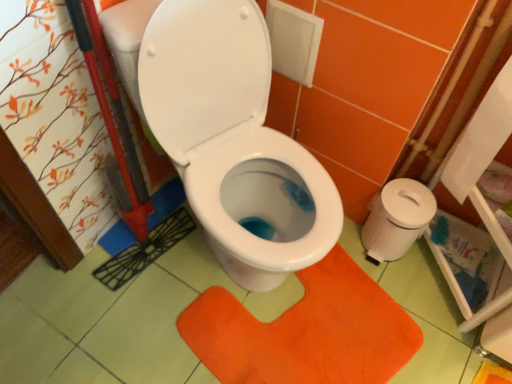
Question: From a real-world perspective, is white plastic toilet paper at right, which is the 2th toilet paper from front to back, on orange textured mat at center?

Choices:
 (A) no
 (B) yes

Answer: (B)

Question: Can you confirm if white plastic toilet paper at right, which is the 2th toilet paper from front to back, is wider than orange textured mat at center?

Choices:
 (A) yes
 (B) no

Answer: (B)

Question: Is white plastic toilet paper at right, which is the 2th toilet paper from front to back, facing away from orange textured mat at center?

Choices:
 (A) no
 (B) yes

Answer: (A)

Question: Considering the relative positions of white plastic toilet paper at right, which is the 2th toilet paper from front to back, and orange textured mat at center in the image provided, is white plastic toilet paper at right, which is the 2th toilet paper from front to back, to the right of orange textured mat at center from the viewer's perspective?

Choices:
 (A) yes
 (B) no

Answer: (A)

Question: From the image's perspective, is white plastic toilet paper at right, positioned as the 1th toilet paper in back-to-front order, over orange textured mat at center?

Choices:
 (A) no
 (B) yes

Answer: (B)

Question: Considering the relative positions of white paper at right, which is the second toilet paper from back to front, and orange textured mat at center in the image provided, is white paper at right, which is the second toilet paper from back to front, to the left or to the right of orange textured mat at center?

Choices:
 (A) left
 (B) right

Answer: (B)

Question: In terms of width, does white paper at right, acting as the 1th toilet paper starting from the front, look wider or thinner when compared to orange textured mat at center?

Choices:
 (A) thin
 (B) wide

Answer: (A)

Question: Is white paper at right, acting as the 1th toilet paper starting from the front, bigger or smaller than orange textured mat at center?

Choices:
 (A) small
 (B) big

Answer: (A)

Question: From the image's perspective, is white paper at right, which is the second toilet paper from back to front, above or below orange textured mat at center?

Choices:
 (A) above
 (B) below

Answer: (A)

Question: Is point (408, 206) closer or farther from the camera than point (509, 69)?

Choices:
 (A) closer
 (B) farther

Answer: (B)

Question: Considering their positions, is white plastic toilet paper at right, which is the 2th toilet paper from front to back, located in front of or behind white paper at right, acting as the 1th toilet paper starting from the front?

Choices:
 (A) front
 (B) behind

Answer: (B)

Question: Looking at their shapes, would you say white plastic toilet paper at right, which is the 2th toilet paper from front to back, is wider or thinner than white paper at right, which is the second toilet paper from back to front?

Choices:
 (A) thin
 (B) wide

Answer: (B)

Question: Based on their positions, is white plastic toilet paper at right, which is the 2th toilet paper from front to back, located to the left or right of white paper at right, acting as the 1th toilet paper starting from the front?

Choices:
 (A) left
 (B) right

Answer: (A)

Question: Considering the positions of point (402, 195) and point (378, 379), is point (402, 195) closer or farther from the camera than point (378, 379)?

Choices:
 (A) closer
 (B) farther

Answer: (B)

Question: Is white plastic toilet paper at right, which is the 2th toilet paper from front to back, bigger or smaller than orange textured mat at center?

Choices:
 (A) small
 (B) big

Answer: (A)